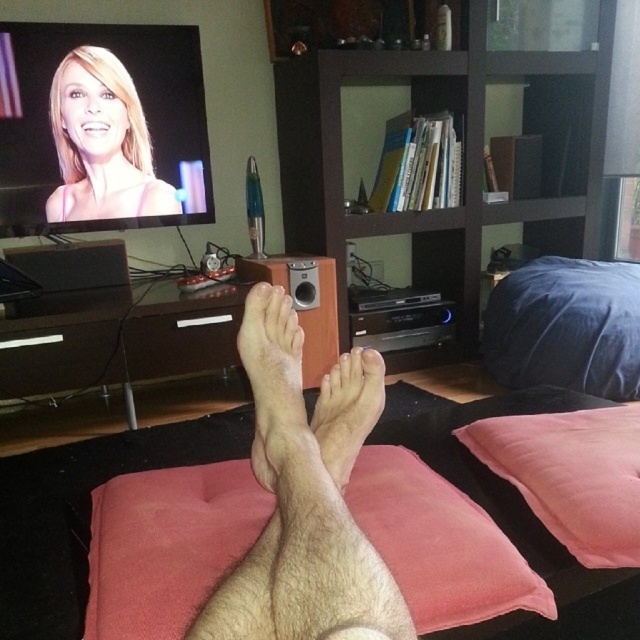
Is pink fabric pillow at lower right below blonde hair at upper left?

Yes, pink fabric pillow at lower right is below blonde hair at upper left.

Does pink fabric pillow at lower right have a lesser width compared to blonde hair at upper left?

Yes, pink fabric pillow at lower right is thinner than blonde hair at upper left.

Between point (518, 476) and point (156, 182), which one is positioned in front?

Point (518, 476) is in front.

The image size is (640, 640). In order to click on pink fabric pillow at lower right in this screenshot , I will do `click(572, 476)`.

Which is more to the right, brown wood entertainment center at center or hairless skin at center?

brown wood entertainment center at center

Does brown wood entertainment center at center appear over hairless skin at center?

Yes.

Is point (435, 269) behind point (365, 381)?

Yes, point (435, 269) is farther from viewer.

Find the location of a particular element. The width and height of the screenshot is (640, 640). brown wood entertainment center at center is located at coordinates (460, 144).

Is hair-covered skin at center bigger than hairless skin at center?

Yes.

Does hair-covered skin at center appear on the right side of hairless skin at center?

In fact, hair-covered skin at center is to the left of hairless skin at center.

In the scene shown: Measure the distance between point (362,388) and camera.

33.76 inches

The width and height of the screenshot is (640, 640). Find the location of `hair-covered skin at center`. hair-covered skin at center is located at coordinates (305, 497).